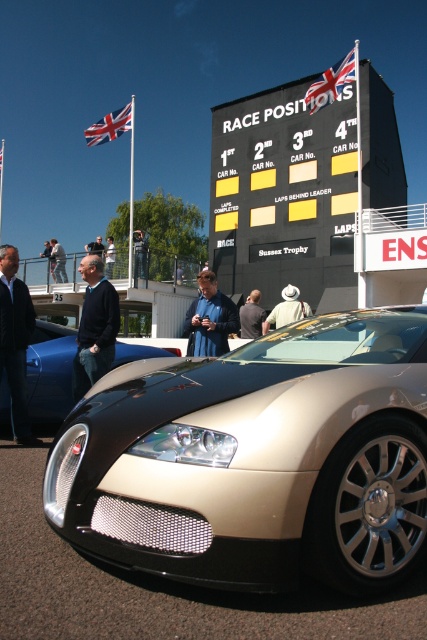
You are a photographer at the motorsport event and want to capture a photo of the shiny blue car at center and the dark blue jacket at center. Since you need to ensure both are fully visible in the frame, which object should you adjust your camera angle to focus on first to avoid cropping?

The shiny blue car at center is taller than the dark blue jacket at center, so you should focus on the shiny blue car at center first to ensure its full height fits in the frame before adjusting for the jacket.

You are a photographer at the motorsport event and want to capture both the sports car and the scoreboard. You are standing at a position where you can see both the point at (x=231, y=164) and the point at (x=20, y=403). Which point is closer to your camera?

Point (x=20, y=403) is closer to the camera than point (x=231, y=164).